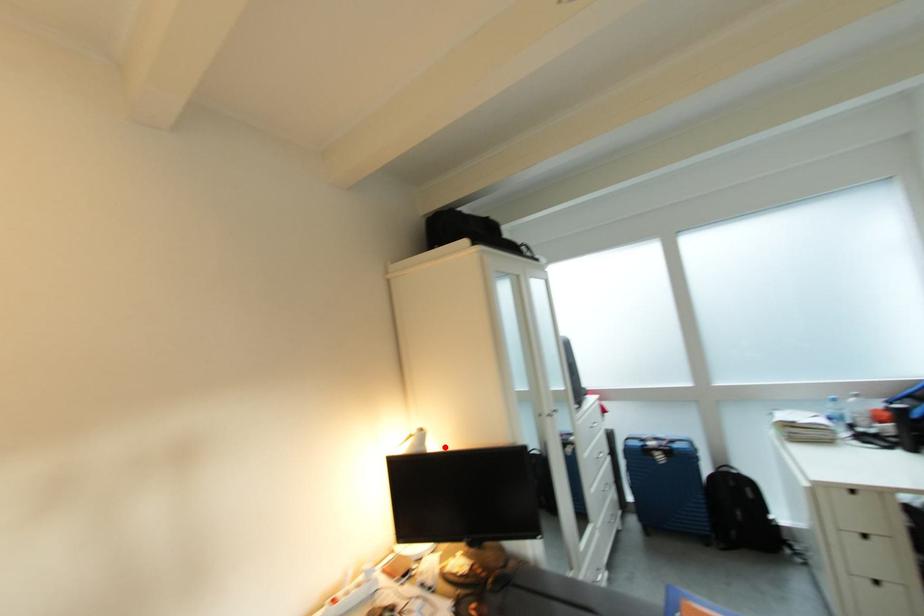
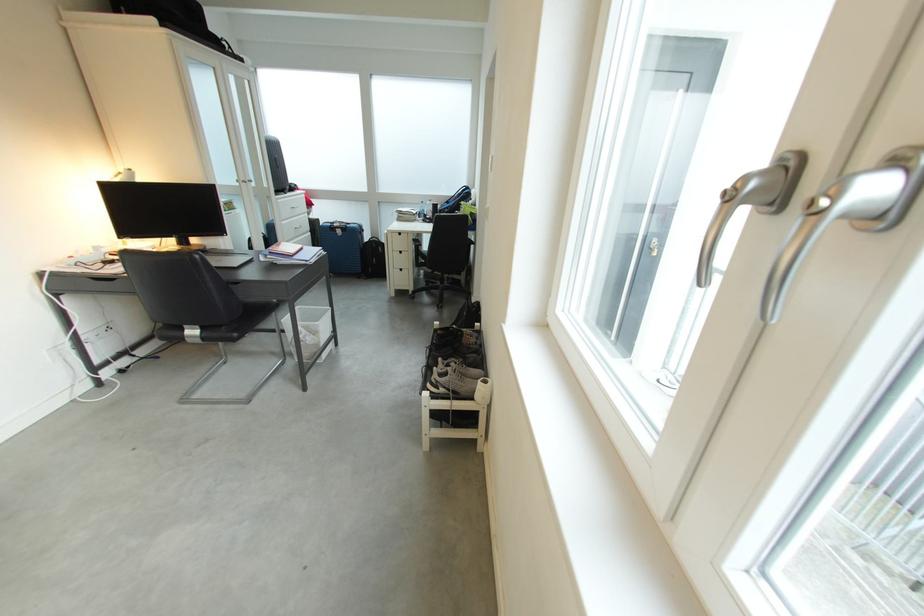
Question: I am providing you with two images of the same scene from different viewpoints. A red point is marked on the first image. At the location where the point appears in image 1, is it still visible in image 2?

Choices:
 (A) Yes
 (B) No

Answer: (A)